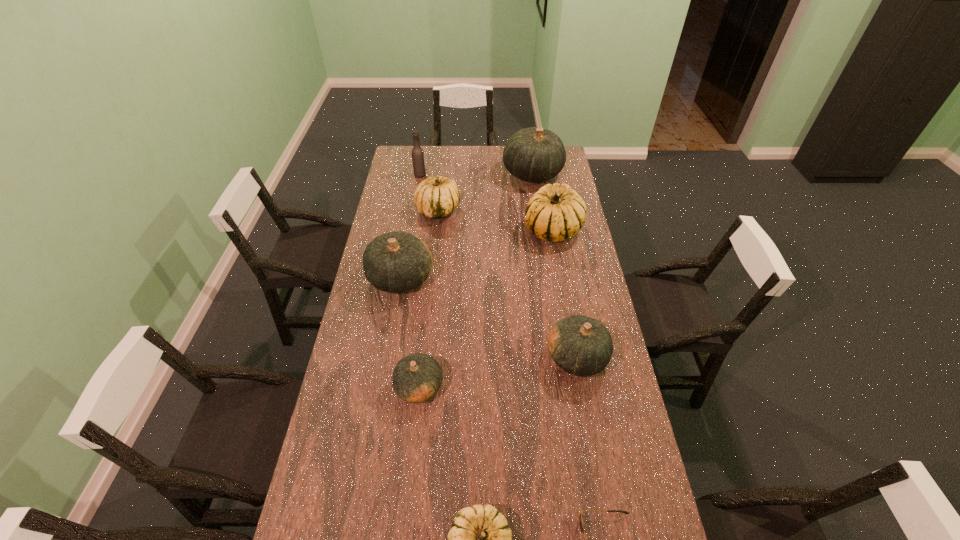
Find the location of `the tallest gourd`. the tallest gourd is located at coordinates (533, 154).

In order to click on the farthest orange gourd in this screenshot , I will do `click(533, 154)`.

Image resolution: width=960 pixels, height=540 pixels. In order to click on beer bottle in this screenshot , I will do `click(418, 160)`.

Identify the location of the third smallest orange gourd. This screenshot has width=960, height=540. click(396, 262).

Find the location of a particular element. the fourth farthest gourd is located at coordinates (396, 262).

Locate an element on the screen. The image size is (960, 540). the biggest white gourd is located at coordinates (556, 212).

Find the location of a particular element. The width and height of the screenshot is (960, 540). the second smallest orange gourd is located at coordinates (580, 345).

Locate an element on the screen. The width and height of the screenshot is (960, 540). the leftmost white gourd is located at coordinates (435, 197).

I want to click on the smallest orange gourd, so click(416, 378).

Where is `free point located 0.230m on the front of the farthest orange gourd`? free point located 0.230m on the front of the farthest orange gourd is located at coordinates (540, 221).